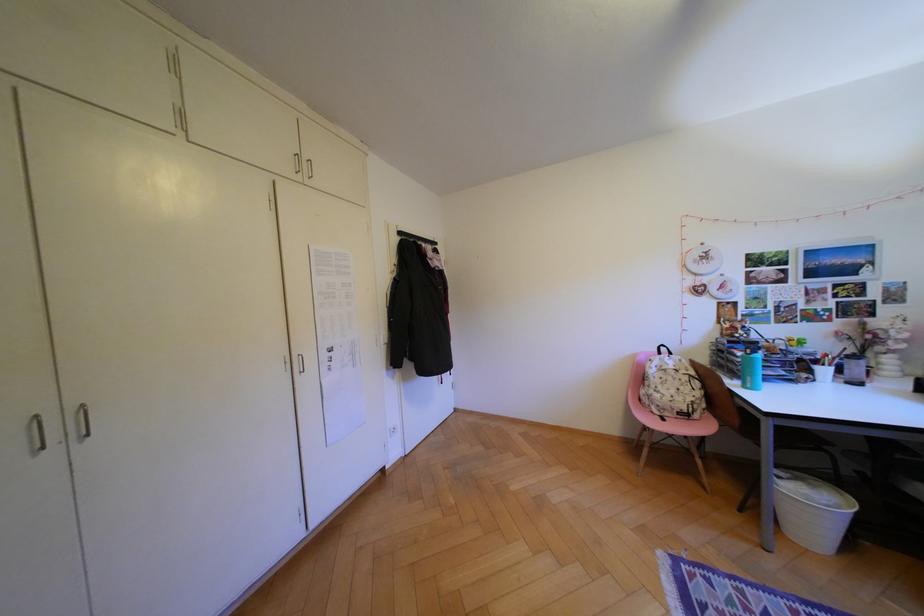
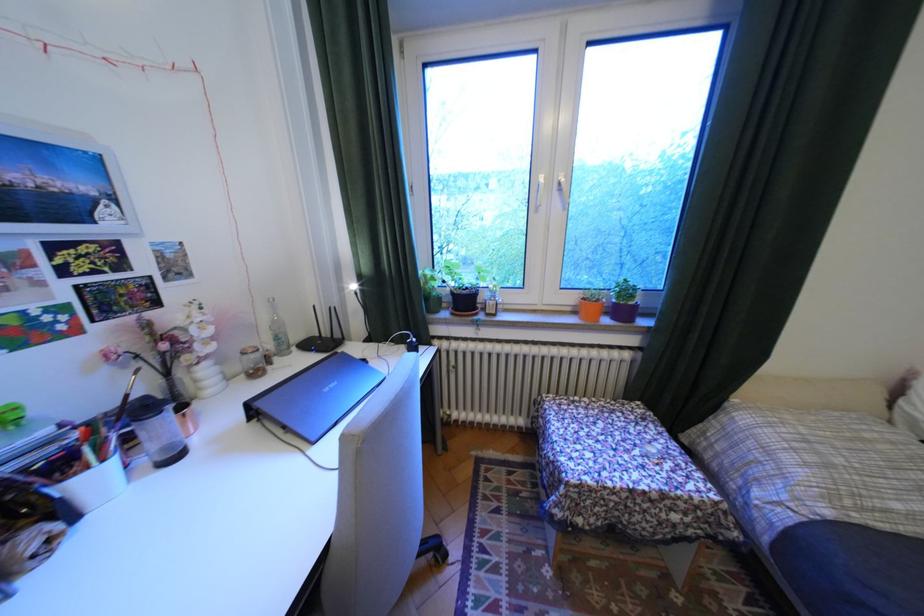
Where in the second image is the point corresponding to [835,371] from the first image?

(106, 479)